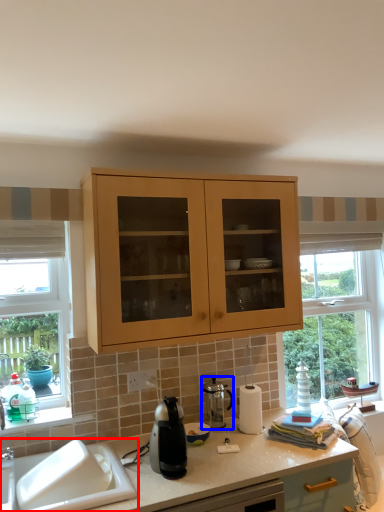
Question: Which point is further to the camera, sink (highlighted by a red box) or appliance (highlighted by a blue box)?

Choices:
 (A) sink
 (B) appliance

Answer: (B)